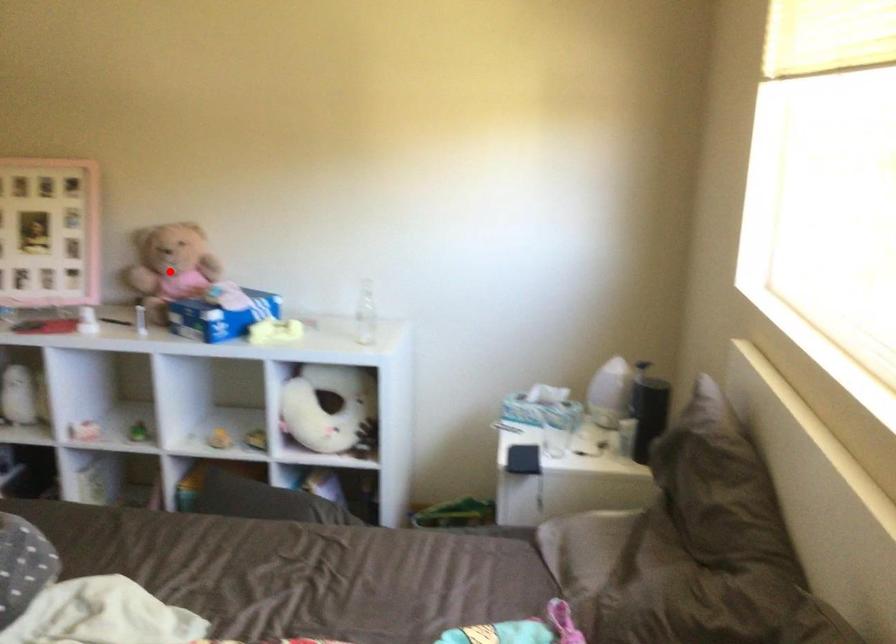
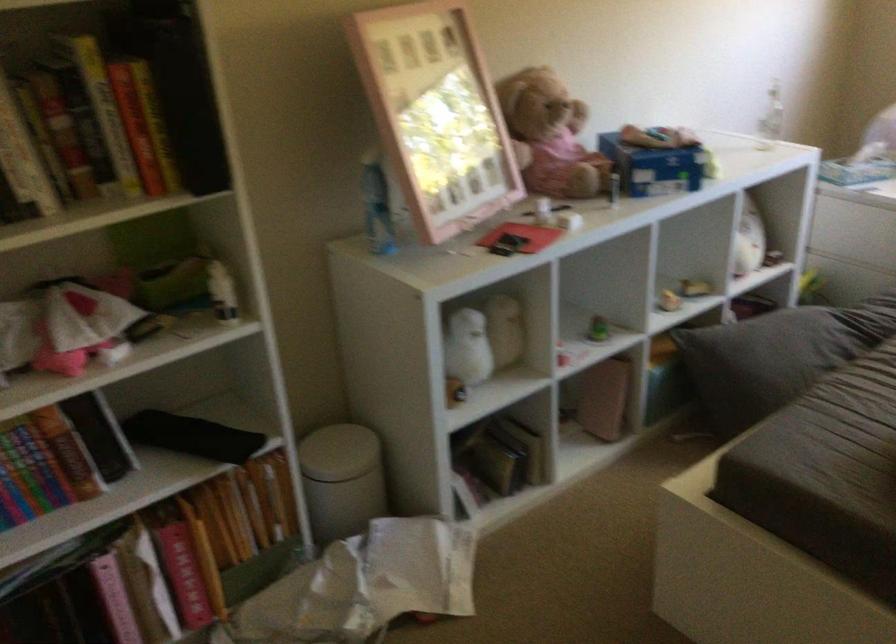
Question: I am providing you with two images of the same scene from different viewpoints. In image1, a red point is highlighted. Considering the same 3D point in image2, which of the following is correct?

Choices:
 (A) It is closer
 (B) It is farther

Answer: (A)